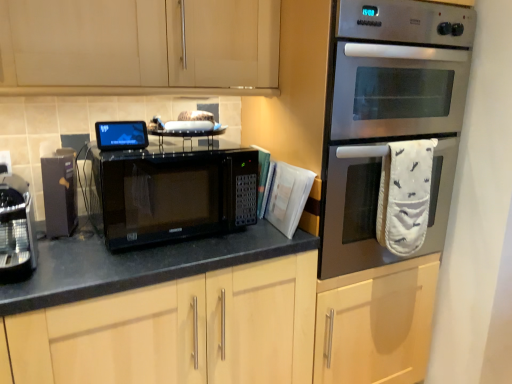
Identify the location of unoccupied space behind sleek metallic coffee machine at left, acting as the 1th appliance starting from the left. This screenshot has width=512, height=384. (62, 242).